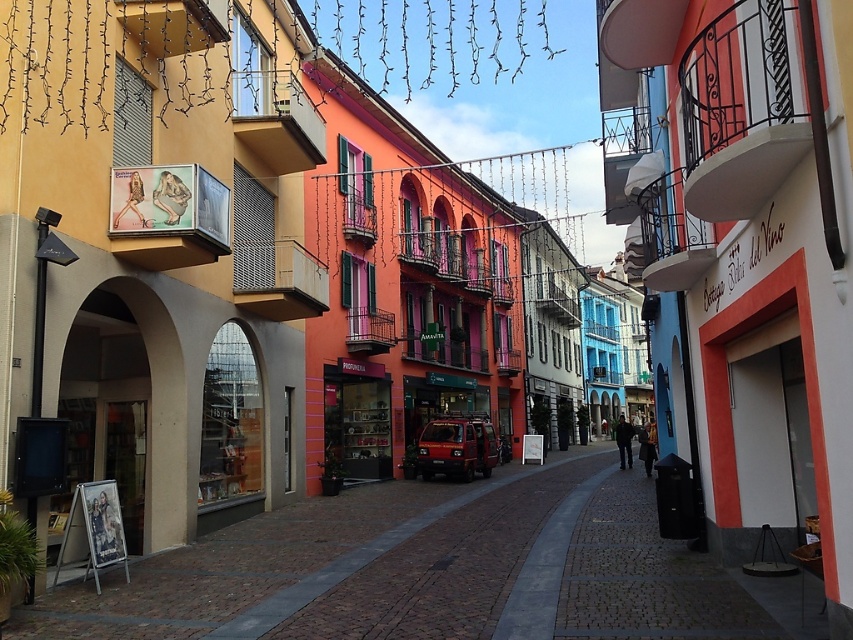
Which is more to the right, brick paved alley at center or matte red van at center?

matte red van at center is more to the right.

Which of these two, brick paved alley at center or matte red van at center, stands taller?

matte red van at center

Between point (672, 552) and point (459, 461), which one is positioned behind?

Point (459, 461)

At what (x,y) coordinates should I click in order to perform the action: click on brick paved alley at center. Please return your answer as a coordinate pair (x, y). Image resolution: width=853 pixels, height=640 pixels. Looking at the image, I should click on (438, 572).